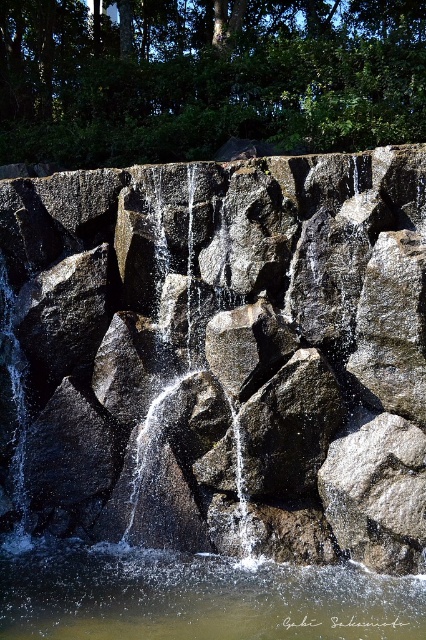
Is dark gray rock at center below clear water at center?

No.

How far apart are dark gray rock at center and clear water at center?

dark gray rock at center and clear water at center are 4.10 feet apart.

This screenshot has height=640, width=426. Describe the element at coordinates (229, 353) in the screenshot. I see `dark gray rock at center` at that location.

Identify the location of dark gray rock at center. The width and height of the screenshot is (426, 640). (229, 353).